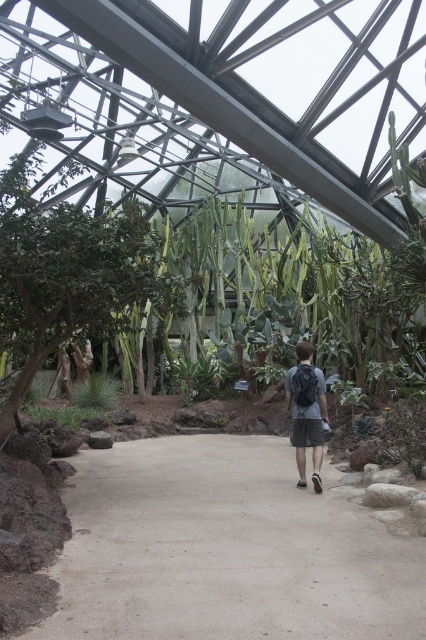
Question: Which point is closer to the camera?

Choices:
 (A) dark gray backpack at center
 (B) smooth concrete path at center

Answer: (B)

Question: Is smooth concrete path at center wider than dark gray backpack at center?

Choices:
 (A) yes
 (B) no

Answer: (A)

Question: Which point is farther from the camera taking this photo?

Choices:
 (A) (118, 474)
 (B) (299, 483)

Answer: (A)

Question: Is the position of smooth concrete path at center less distant than that of dark gray backpack at center?

Choices:
 (A) no
 (B) yes

Answer: (B)

Question: Considering the relative positions of smooth concrete path at center and dark gray backpack at center in the image provided, where is smooth concrete path at center located with respect to dark gray backpack at center?

Choices:
 (A) left
 (B) right

Answer: (A)